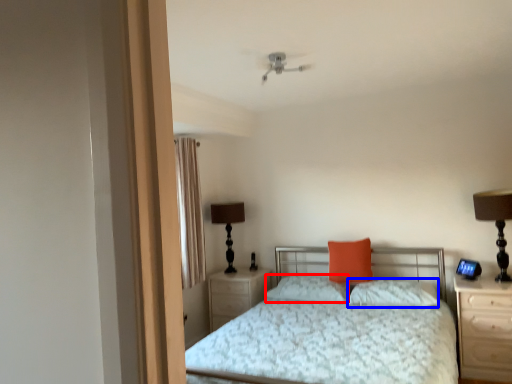
Question: Among these objects, which one is farthest to the camera, pillow (highlighted by a red box) or pillow (highlighted by a blue box)?

Choices:
 (A) pillow
 (B) pillow

Answer: (A)